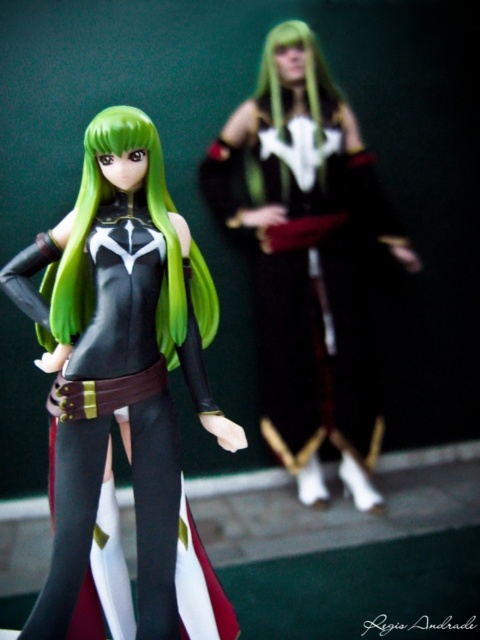
You are an art curator arranging an exhibition. You have two points marked in the image for placing labels. The first point is at coordinates point (302, 468) and the second at point (128, 125). Which point is closer to the foreground figurine?

Point (128, 125) is closer to the foreground figurine because it is in front of point (302, 468), which is behind it.

You are an art curator arranging an exhibition and want to place a spotlight on the matte black dress at upper right. Given that the spotlight can only illuminate a circular area with a radius of 0.1 units centered at point (307, 259), will the spotlight effectively highlight the matte black dress at upper right?

The spotlight is centered at point (307, 259), which is exactly where the matte black dress at upper right is located. Therefore, the spotlight will effectively highlight the matte black dress at upper right.

You are a photographer setting up a shot for a catalog. The matte black figure at left needs to be exactly 36 inches away from the camera. Currently, it is positioned at 34.61 inches. Should you move it closer or farther away to meet the requirement?

The matte black figure at left is currently 34.61 inches away from the camera. To reach the required 36 inches, you should move it farther away by approximately 1.39 inches.